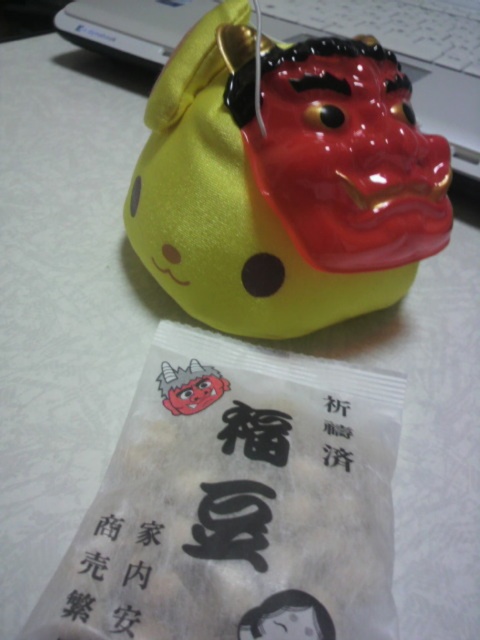
You are standing at the position of the white paper bag and want to reach the dragon figurine. Which direction should you move to first? The dragon figurine is located at point [431,227] and the white paper bag is at point [111,632]. You can only move in straight lines or turn 90 degrees. The path must go through both points. Which direction should you move first?

Since point [431,227] is behind point [111,632] from the perspective of the white paper bag, you should move towards the dragon figurine by first moving in the direction opposite to where the white paper bag is located. However, since you must go through both points, you need to start at the white paper bag and move towards the dragon figurine. The dragon figurine is located at point [431,227], which is to the left and upwards from the white paper bag at [111,632]. Therefore, you should first go

You are standing at the point marked by the coordinate point (280, 113). You want to place a new object that requires a space of 3 feet in front of you. Is there enough space between you and the ceramic dragon figurine to place it?

The distance between you and the ceramic dragon figurine is 3.47 feet, so yes, there is enough space to place the new object since it requires 3 feet.

Looking at this image, you are a child who wants to grab both the shiny yellow plush toy at center and the white paper bag in front of the figurine. Can you reach both items without moving your position?

The shiny yellow plush toy at center and the white paper bag are 3.39 feet apart. Since the distance between them is more than an average child arm length, you can only reach one of them without moving.